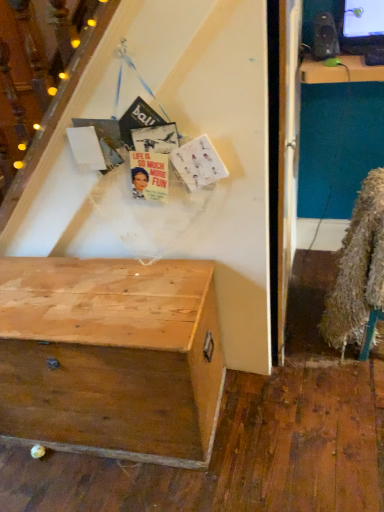
Describe the element at coordinates (358, 269) in the screenshot. I see `fuzzy brown fur coat at lower right` at that location.

Locate an element on the screen. The width and height of the screenshot is (384, 512). fuzzy brown fur coat at lower right is located at coordinates (358, 269).

Between matte black speaker at upper right and wooden chest at lower left, which one has smaller width?

matte black speaker at upper right is thinner.

From the image's perspective, would you say matte black speaker at upper right is positioned over wooden chest at lower left?

Yes, from the image's perspective, matte black speaker at upper right is on top of wooden chest at lower left.

Which is nearer, (327,20) or (3,336)?

Point (327,20) is farther from the camera than point (3,336).

From a real-world perspective, which object rests below the other?

From a 3D spatial view, wooden chest at lower left is below.

What's the angular difference between wooden chest at lower left and matte black speaker at upper right's facing directions?

31.8 degrees.

Is wooden chest at lower left taller or shorter than matte black speaker at upper right?

wooden chest at lower left is taller than matte black speaker at upper right.

Looking at their sizes, would you say wooden chest at lower left is wider or thinner than matte black speaker at upper right?

wooden chest at lower left is wider than matte black speaker at upper right.

Identify the location of desk in front of the fuzzy brown fur coat at lower right. This screenshot has height=512, width=384. (111, 357).

Considering the relative positions of wooden chest at lower left and fuzzy brown fur coat at lower right in the image provided, is wooden chest at lower left to the left of fuzzy brown fur coat at lower right from the viewer's perspective?

Yes, wooden chest at lower left is to the left of fuzzy brown fur coat at lower right.

From the picture: From a real-world perspective, which object stands above the other?

From a 3D spatial view, fuzzy brown fur coat at lower right is above.

Is fuzzy brown fur coat at lower right inside wooden chest at lower left?

No.

Is matte black speaker at upper right bigger than fuzzy brown fur coat at lower right?

Actually, matte black speaker at upper right might be smaller than fuzzy brown fur coat at lower right.

Is point (325, 26) closer or farther from the camera than point (362, 263)?

Clearly, point (325, 26) is more distant from the camera than point (362, 263).

Would you say matte black speaker at upper right is outside fuzzy brown fur coat at lower right?

matte black speaker at upper right lies outside fuzzy brown fur coat at lower right's area.

From the image's perspective, which one is positioned lower, matte black speaker at upper right or fuzzy brown fur coat at lower right?

fuzzy brown fur coat at lower right.

Choose the correct answer: Is fuzzy brown fur coat at lower right inside wooden chest at lower left or outside it?

fuzzy brown fur coat at lower right cannot be found inside wooden chest at lower left.

From their relative heights in the image, would you say fuzzy brown fur coat at lower right is taller or shorter than wooden chest at lower left?

fuzzy brown fur coat at lower right is taller than wooden chest at lower left.

In terms of size, does fuzzy brown fur coat at lower right appear bigger or smaller than wooden chest at lower left?

Clearly, fuzzy brown fur coat at lower right is smaller in size than wooden chest at lower left.

Considering the relative positions of fuzzy brown fur coat at lower right and matte black speaker at upper right in the image provided, is fuzzy brown fur coat at lower right to the left of matte black speaker at upper right from the viewer's perspective?

No.

Looking at this image, how far apart are fuzzy brown fur coat at lower right and matte black speaker at upper right?

37.41 inches.

From the image's perspective, does fuzzy brown fur coat at lower right appear higher than matte black speaker at upper right?

No, from the image's perspective, fuzzy brown fur coat at lower right is not above matte black speaker at upper right.

Is matte black speaker at upper right at the back of fuzzy brown fur coat at lower right?

That's not correct — fuzzy brown fur coat at lower right is not looking away from matte black speaker at upper right.

Where is `loudspeaker behind the wooden chest at lower left`? loudspeaker behind the wooden chest at lower left is located at coordinates (324, 37).

Find the location of a particular element. The height and width of the screenshot is (512, 384). loudspeaker on the right of wooden chest at lower left is located at coordinates (324, 37).

Looking at the image, which one is located further to fuzzy brown fur coat at lower right, wooden chest at lower left or matte black speaker at upper right?

Among the two, matte black speaker at upper right is located further to fuzzy brown fur coat at lower right.

From the image, which object appears to be nearer to wooden chest at lower left, fuzzy brown fur coat at lower right or matte black speaker at upper right?

fuzzy brown fur coat at lower right lies closer to wooden chest at lower left than the other object.

When comparing their distances from fuzzy brown fur coat at lower right, does matte black speaker at upper right or wooden chest at lower left seem further?

matte black speaker at upper right is further to fuzzy brown fur coat at lower right.

Based on their spatial positions, is matte black speaker at upper right or fuzzy brown fur coat at lower right closer to wooden chest at lower left?

fuzzy brown fur coat at lower right is closer to wooden chest at lower left.

Considering their positions, is wooden chest at lower left positioned further to matte black speaker at upper right than fuzzy brown fur coat at lower right?

wooden chest at lower left.

Consider the image. Which object lies further to the anchor point matte black speaker at upper right, fuzzy brown fur coat at lower right or wooden chest at lower left?

The object further to matte black speaker at upper right is wooden chest at lower left.

The image size is (384, 512). I want to click on fur coat that lies between matte black speaker at upper right and wooden chest at lower left from top to bottom, so point(358,269).